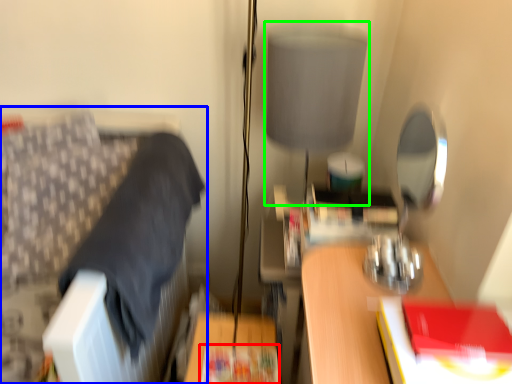
Question: Which object is positioned farthest from paperback book (highlighted by a red box)? Select from furniture (highlighted by a blue box) and table lamp (highlighted by a green box).

Choices:
 (A) furniture
 (B) table lamp

Answer: (B)